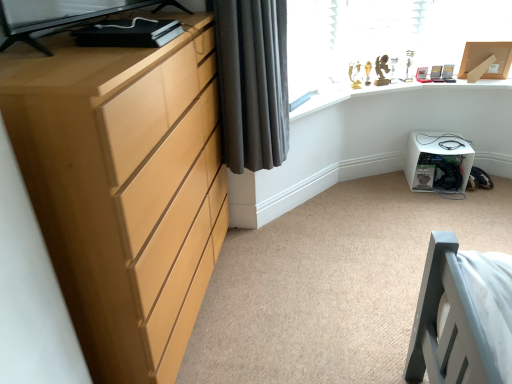
Question: Is white plastic storage box at lower right facing away from gold metallic trophy case at upper right?

Choices:
 (A) yes
 (B) no

Answer: (B)

Question: Is white plastic storage box at lower right positioned in front of gold metallic trophy case at upper right?

Choices:
 (A) yes
 (B) no

Answer: (B)

Question: Does white plastic storage box at lower right have a lesser height compared to gold metallic trophy case at upper right?

Choices:
 (A) yes
 (B) no

Answer: (B)

Question: Considering the relative sizes of white plastic storage box at lower right and gold metallic trophy case at upper right in the image provided, is white plastic storage box at lower right bigger than gold metallic trophy case at upper right?

Choices:
 (A) no
 (B) yes

Answer: (A)

Question: Considering the relative positions of white plastic storage box at lower right and gold metallic trophy case at upper right in the image provided, is white plastic storage box at lower right behind gold metallic trophy case at upper right?

Choices:
 (A) yes
 (B) no

Answer: (A)

Question: Does white plastic storage box at lower right have a lesser width compared to gold metallic trophy case at upper right?

Choices:
 (A) yes
 (B) no

Answer: (A)

Question: From the image's perspective, is gold metallic trophy case at upper right above white plastic storage box at lower right?

Choices:
 (A) yes
 (B) no

Answer: (A)

Question: Is gold metallic trophy case at upper right touching white plastic storage box at lower right?

Choices:
 (A) yes
 (B) no

Answer: (B)

Question: Does gold metallic trophy case at upper right have a smaller size compared to white plastic storage box at lower right?

Choices:
 (A) yes
 (B) no

Answer: (B)

Question: From a real-world perspective, is gold metallic trophy case at upper right located higher than white plastic storage box at lower right?

Choices:
 (A) yes
 (B) no

Answer: (A)

Question: Is white plastic storage box at lower right at the back of gold metallic trophy case at upper right?

Choices:
 (A) yes
 (B) no

Answer: (B)

Question: Is gold metallic trophy case at upper right positioned before white plastic storage box at lower right?

Choices:
 (A) no
 (B) yes

Answer: (B)

Question: Can you confirm if dark grey fabric curtain at upper left is shorter than white plastic storage box at lower right?

Choices:
 (A) yes
 (B) no

Answer: (B)